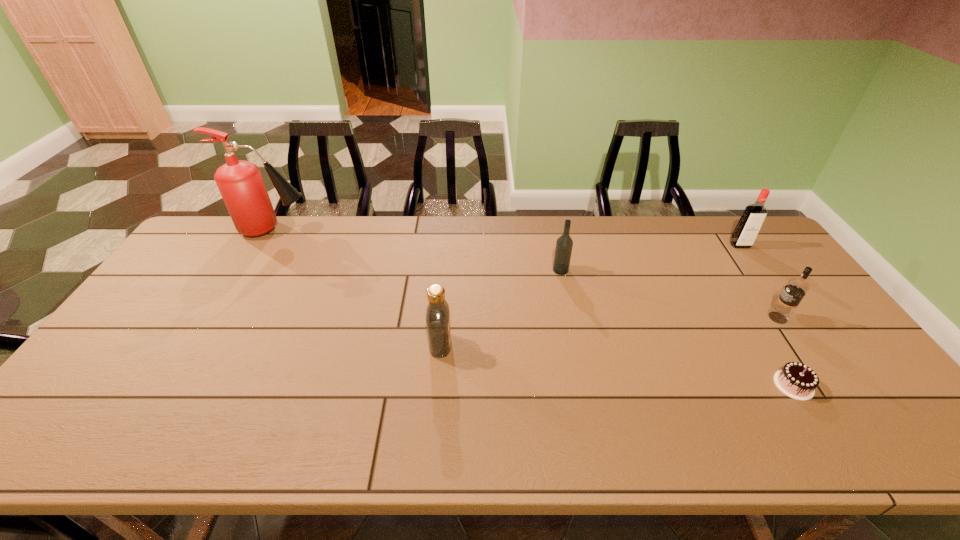
Locate an element on the screen. The image size is (960, 540). object that is at the left edge is located at coordinates (240, 183).

This screenshot has width=960, height=540. I want to click on chocolate cake present at the right edge, so click(796, 380).

The height and width of the screenshot is (540, 960). I want to click on object present at the far left corner, so click(240, 183).

Where is `object at the far right corner`? This screenshot has width=960, height=540. object at the far right corner is located at coordinates (749, 225).

This screenshot has width=960, height=540. In the image, there is a desktop. Find the location of `vacant space at the far edge`. vacant space at the far edge is located at coordinates (697, 247).

Where is `vacant space at the near edge of the desktop`? vacant space at the near edge of the desktop is located at coordinates [298, 428].

This screenshot has width=960, height=540. What are the coordinates of `vacant space at the left edge of the desktop` in the screenshot? It's located at (124, 395).

Locate an element on the screen. The height and width of the screenshot is (540, 960). free region at the right edge of the desktop is located at coordinates (854, 401).

This screenshot has height=540, width=960. In the image, there is a desktop. Find the location of `vacant space at the far right corner`. vacant space at the far right corner is located at coordinates (706, 224).

Locate an element on the screen. unoccupied area between the second farthest vodka and the nearest vodka is located at coordinates (500, 307).